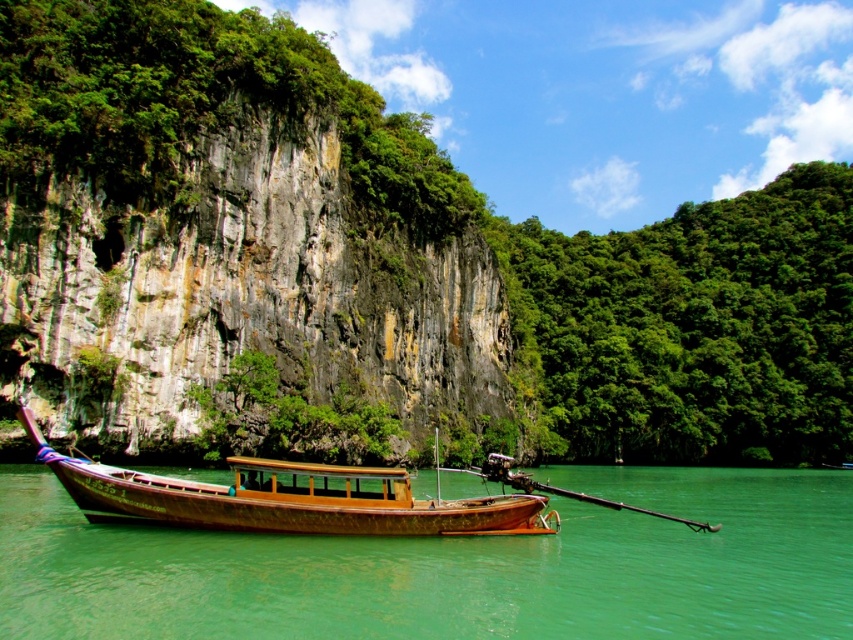
Is green water at boat center in front of wooden boat at center?

That is True.

Who is positioned more to the right, green water at boat center or wooden boat at center?

Positioned to the right is green water at boat center.

The width and height of the screenshot is (853, 640). What do you see at coordinates (451, 566) in the screenshot?
I see `green water at boat center` at bounding box center [451, 566].

This screenshot has height=640, width=853. What are the coordinates of `green water at boat center` in the screenshot? It's located at (451, 566).